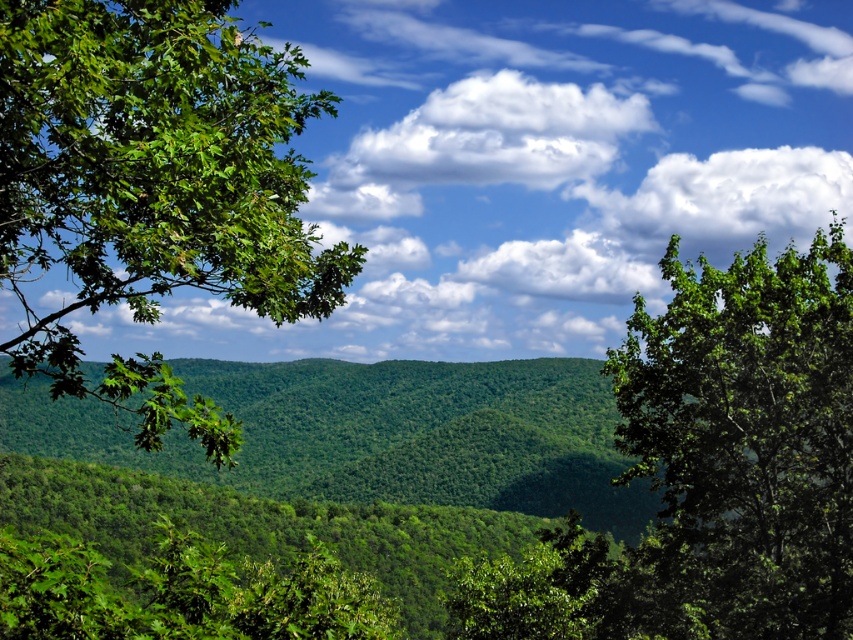
Question: Among these objects, which one is nearest to the camera?

Choices:
 (A) green leafy branch at left
 (B) white fluffy cloud at upper center

Answer: (A)

Question: Does green leafy tree at right have a larger size compared to white fluffy cloud at upper center?

Choices:
 (A) yes
 (B) no

Answer: (A)

Question: Which of these objects is positioned farthest from the white fluffy cloud at upper center?

Choices:
 (A) green leafy branch at left
 (B) green leafy tree at right

Answer: (B)

Question: Does green leafy branch at left appear under green leafy tree at right?

Choices:
 (A) no
 (B) yes

Answer: (A)

Question: Which point is closer to the camera?

Choices:
 (A) (76, 300)
 (B) (711, 392)

Answer: (B)

Question: Does green leafy branch at left appear on the right side of white fluffy cloud at upper center?

Choices:
 (A) no
 (B) yes

Answer: (A)